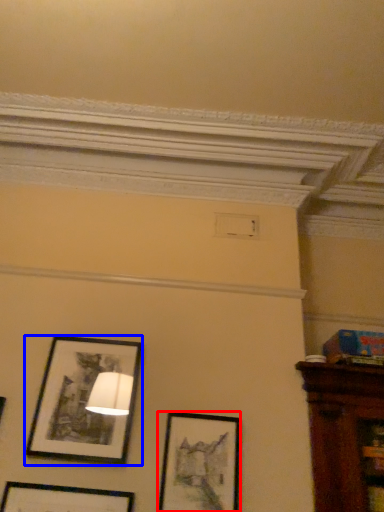
Question: Which object is closer to the camera taking this photo, picture frame (highlighted by a red box) or picture frame (highlighted by a blue box)?

Choices:
 (A) picture frame
 (B) picture frame

Answer: (A)